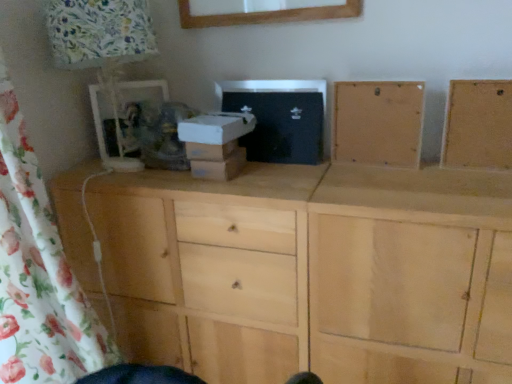
I want to click on vacant space situated on the left part of light wood cabinet at center, arranged as the 2th cabinetry when viewed from the right, so click(x=327, y=167).